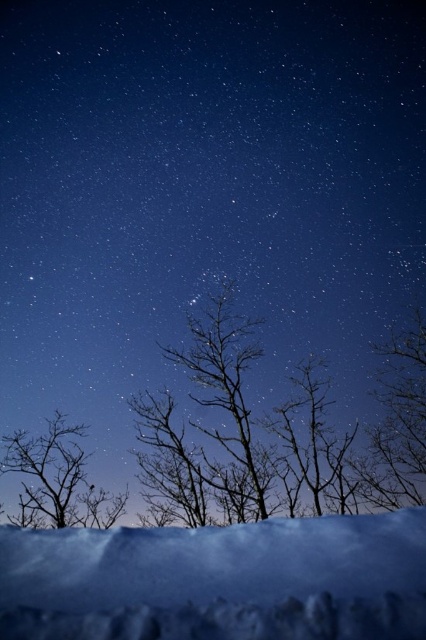
You are an observer standing in the winter night scene. You notice the silhouette bare tree at center and the white fluffy snow at lower center. Which object is taller?

The silhouette bare tree at center is taller than the white fluffy snow at lower center.

You are standing at the edge of the snow and want to walk to the tree. Can you reach the silhouette bare tree at left without stepping on the white fluffy snow at lower center?

The distance between the white fluffy snow at lower center and the silhouette bare tree at left is 7.74 meters. Since you are starting at the edge of the snow, you would have to step onto the snow to reach the tree, so it is not possible to avoid stepping on the white fluffy snow at lower center.